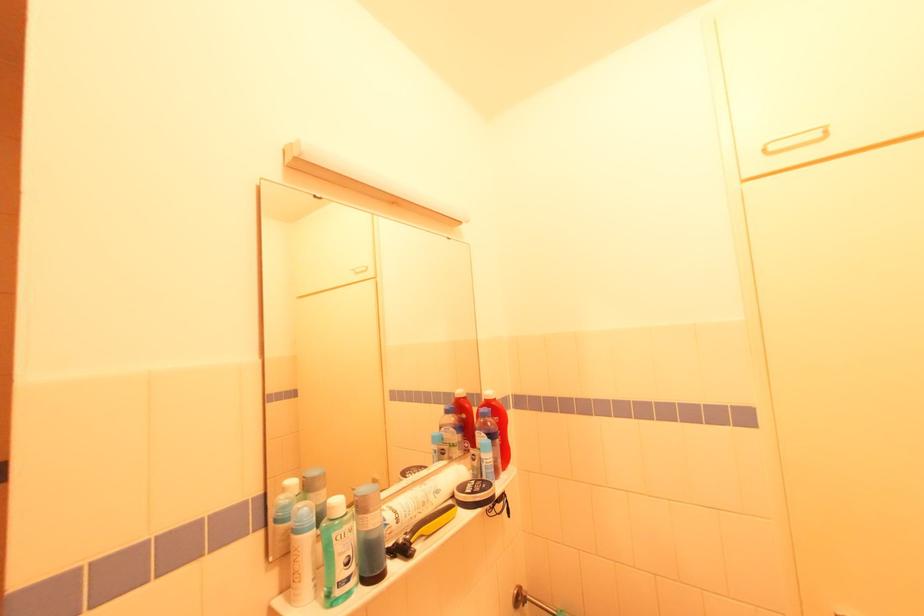
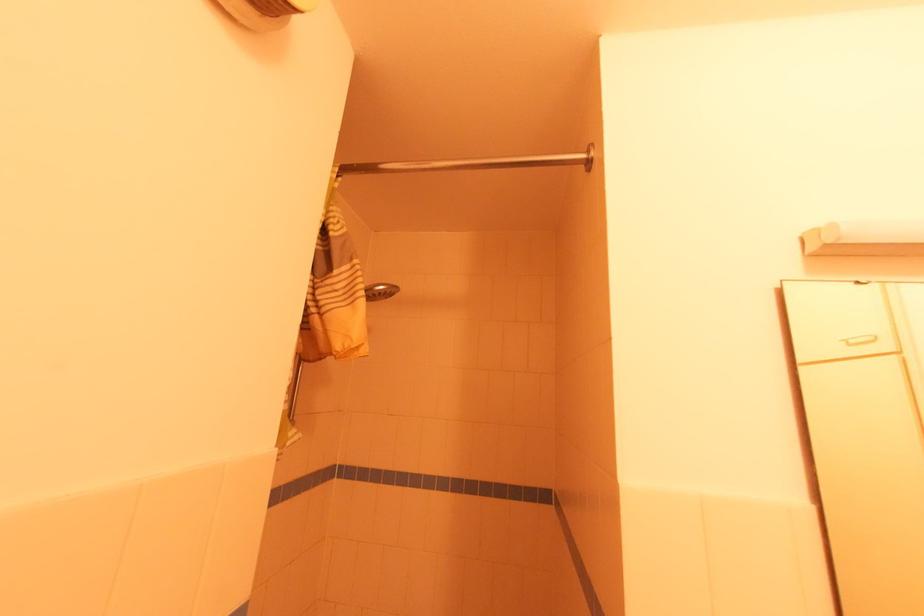
Locate, in the second image, the point that corresponds to [367,270] in the first image.

(871, 339)